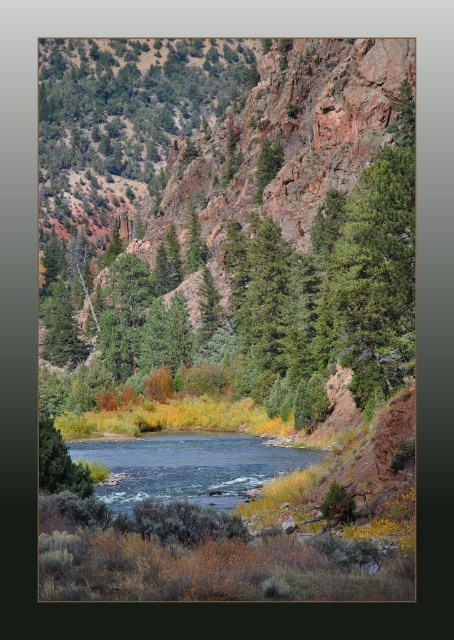
You are standing at the point labeled as point (252, 243) in the image. What type of vegetation are you surrounded by?

You are surrounded by green coniferous trees at center.